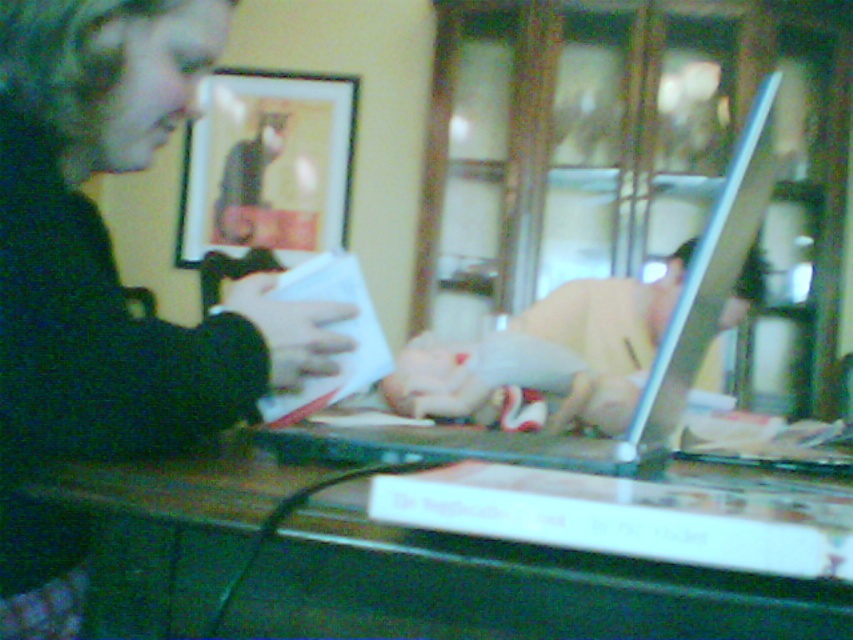
You are a delivery robot with a package that needs to be placed between the matte black laptop at upper right and the silver metallic laptop at center. The package measures 25 centimeters in length. Can you fit the package between them without moving either laptop?

The distance between the matte black laptop at upper right and the silver metallic laptop at center is 25.59 centimeters. Since the package is 25 centimeters long, it can fit between them with a small amount of space remaining.

You are standing in the room shown in the image and want to reach the matte black picture frame at upper center. Considering the distance, can you estimate how far you need to walk to touch it?

The matte black picture frame at upper center is 3.56 meters away from you, so you would need to walk approximately 3.56 meters to touch it.

You are a photographer trying to capture a clear shot of the silver metallic laptop at center. However, there is a matte black picture frame at upper center blocking your view. Can you lower your camera angle to avoid the frame while still focusing on the laptop?

The matte black picture frame at upper center is above the silver metallic laptop at center, so lowering your camera angle would allow you to avoid the frame while still focusing on the laptop.